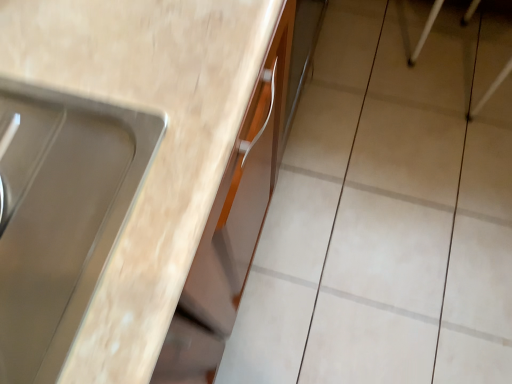
Question: From a real-world perspective, is matte wood countertop at center physically above beige ceramic tile at upper right?

Choices:
 (A) yes
 (B) no

Answer: (A)

Question: From the image's perspective, is matte wood countertop at center below beige ceramic tile at upper right?

Choices:
 (A) yes
 (B) no

Answer: (A)

Question: Does matte wood countertop at center have a larger size compared to beige ceramic tile at upper right?

Choices:
 (A) no
 (B) yes

Answer: (B)

Question: Can you confirm if matte wood countertop at center is wider than beige ceramic tile at upper right?

Choices:
 (A) no
 (B) yes

Answer: (B)

Question: Does matte wood countertop at center have a smaller size compared to beige ceramic tile at upper right?

Choices:
 (A) yes
 (B) no

Answer: (B)

Question: Is beige ceramic tile at upper right located within matte wood countertop at center?

Choices:
 (A) yes
 (B) no

Answer: (B)

Question: Is beige ceramic tile at upper right closer to the viewer compared to matte wood countertop at center?

Choices:
 (A) no
 (B) yes

Answer: (A)

Question: Can you confirm if beige ceramic tile at upper right is wider than matte wood countertop at center?

Choices:
 (A) yes
 (B) no

Answer: (B)

Question: From a real-world perspective, does beige ceramic tile at upper right stand above matte wood countertop at center?

Choices:
 (A) no
 (B) yes

Answer: (A)

Question: Does beige ceramic tile at upper right have a smaller size compared to matte wood countertop at center?

Choices:
 (A) no
 (B) yes

Answer: (B)

Question: Is beige ceramic tile at upper right positioned with its back to matte wood countertop at center?

Choices:
 (A) yes
 (B) no

Answer: (B)

Question: Is matte wood countertop at center surrounded by beige ceramic tile at upper right?

Choices:
 (A) yes
 (B) no

Answer: (B)

Question: Is matte wood countertop at center in front of or behind beige ceramic tile at upper right in the image?

Choices:
 (A) front
 (B) behind

Answer: (A)